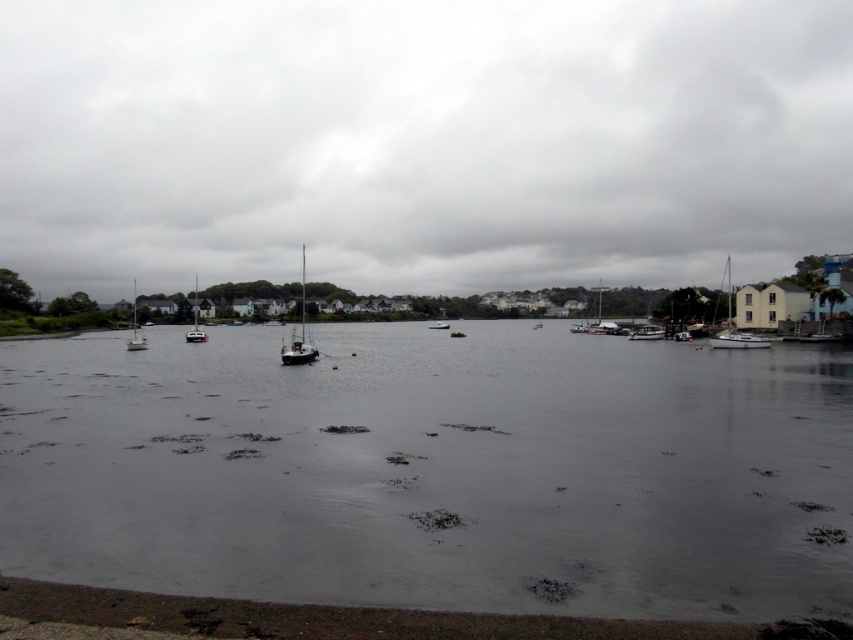
You are standing at the shoreline in the foreground and looking towards the point marked at coordinates (421, 141). What do you see at that point?

At point (421, 141), there is cloudy sky at upper center.

You are standing on the waterfront and want to estimate how far the cloudy sky at upper center is from you. Based on the scene, can you determine the distance?

The cloudy sky at upper center is 305.87 meters away from the viewer.

You are a photographer planning to capture the white plastic boat at right and the white matte sailboat at left in a single frame. Given their widths, which boat will appear wider in the photo?

The white matte sailboat at left will appear wider in the photo since it has a greater width than the white plastic boat at right.